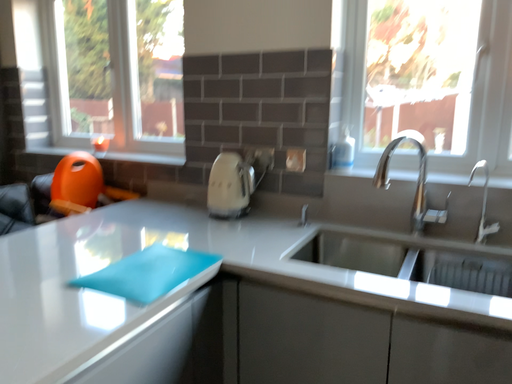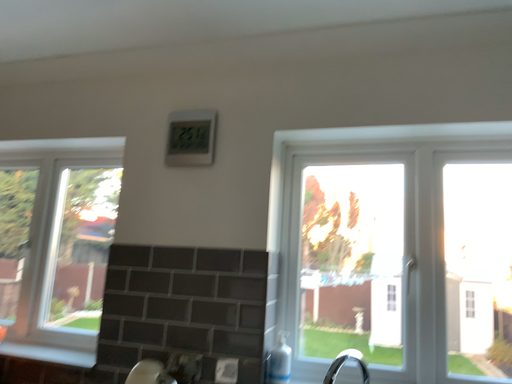
Question: Which way did the camera rotate in the video?

Choices:
 (A) rotated right
 (B) rotated left

Answer: (A)